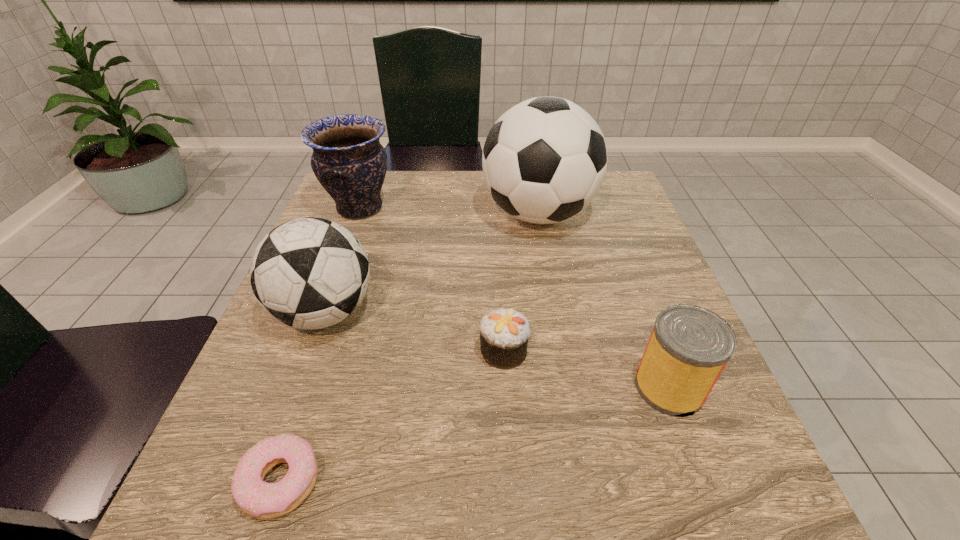
Where is `doughnut present at the left edge`? This screenshot has width=960, height=540. doughnut present at the left edge is located at coordinates (257, 498).

Identify the location of soccer ball that is positioned at the right edge. (544, 160).

You are a GUI agent. You are given a task and a screenshot of the screen. Output one action in this format:
    pyautogui.click(x=<x>, y=<y>)
    Task: Click on the can that is at the right edge
    The width and height of the screenshot is (960, 540).
    Given the screenshot: What is the action you would take?
    pyautogui.click(x=689, y=346)

Where is `object positioned at the far left corner`? This screenshot has width=960, height=540. object positioned at the far left corner is located at coordinates (348, 160).

The width and height of the screenshot is (960, 540). I want to click on object that is at the near left corner, so click(257, 498).

The image size is (960, 540). I want to click on object positioned at the far right corner, so click(544, 160).

In the image, there is a desktop. Identify the location of vacant space at the far edge. (411, 191).

Where is `vacant space at the near edge of the desktop`? vacant space at the near edge of the desktop is located at coordinates (304, 529).

Image resolution: width=960 pixels, height=540 pixels. In the image, there is a desktop. Find the location of `vacant space at the left edge`. vacant space at the left edge is located at coordinates (233, 414).

The width and height of the screenshot is (960, 540). Identify the location of vacant space at the right edge of the desktop. (687, 459).